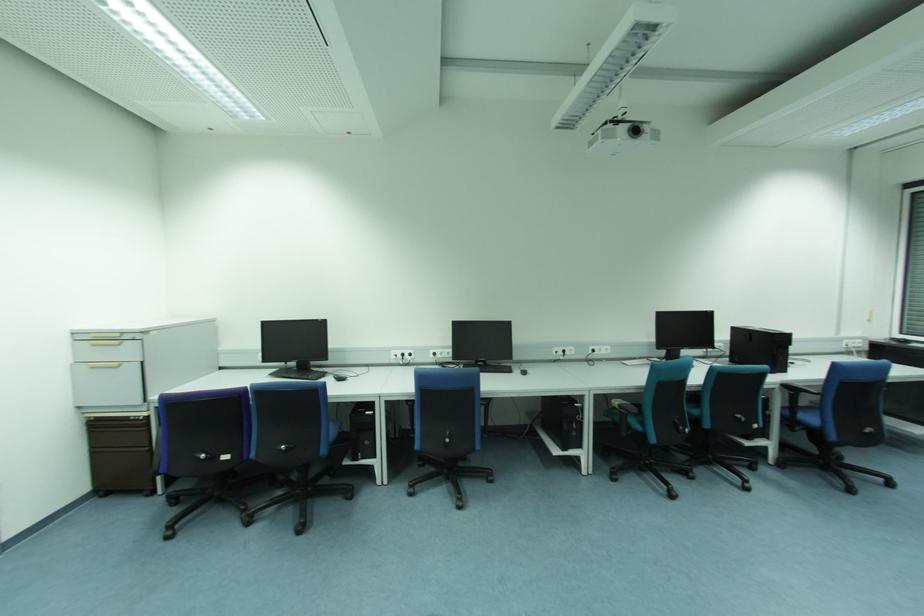
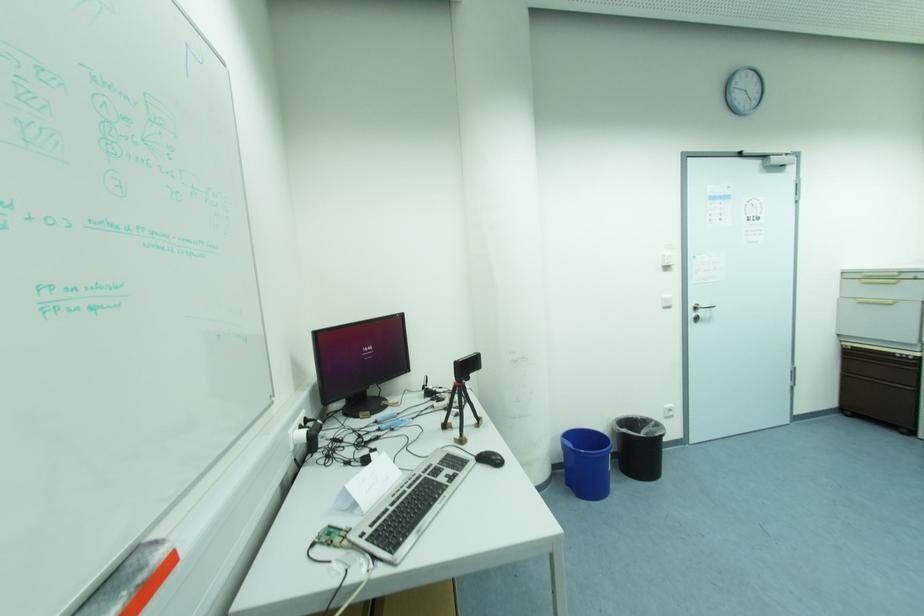
Question: I am providing you with two images of the same scene from different viewpoints. Which of the following objects are not visible in image2?

Choices:
 (A) black webcam
 (B) folded white paper
 (C) blue trash bin
 (D) none of these

Answer: (D)